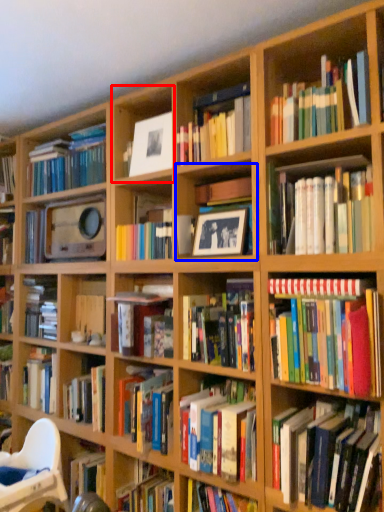
Question: Which of the following is the closest to the observer, shelf (highlighted by a red box) or cabinet (highlighted by a blue box)?

Choices:
 (A) shelf
 (B) cabinet

Answer: (B)